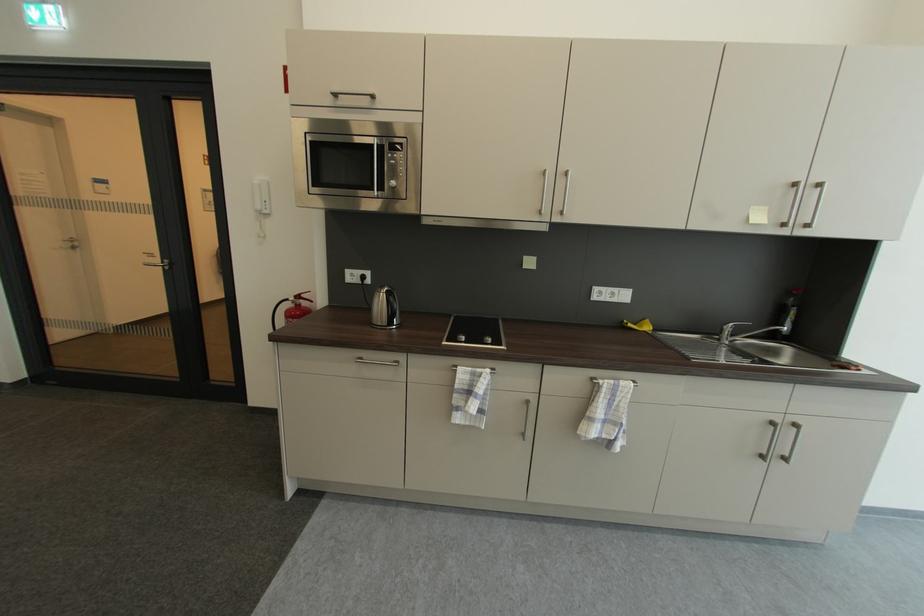
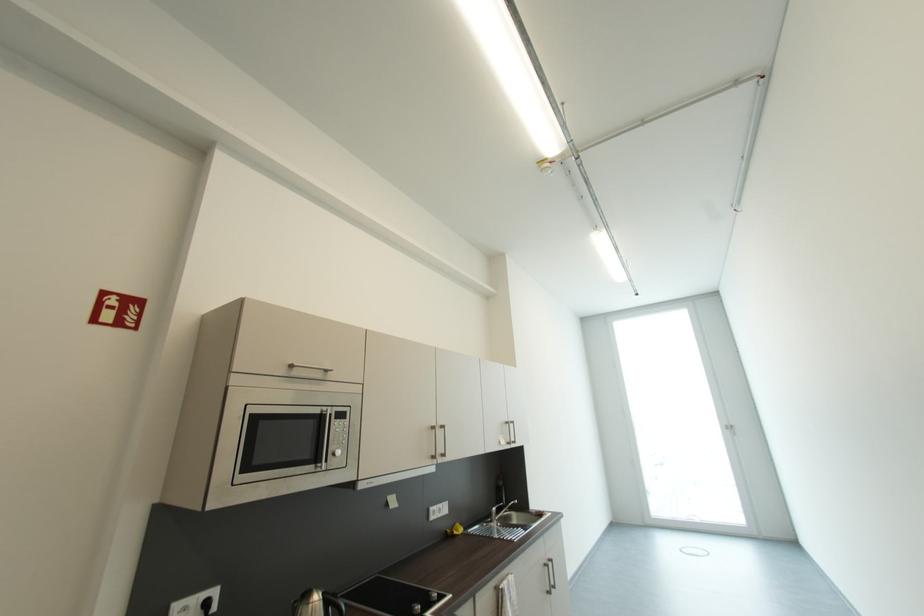
In the second image, find the point that corresponds to point 803,185 in the first image.

(513, 424)